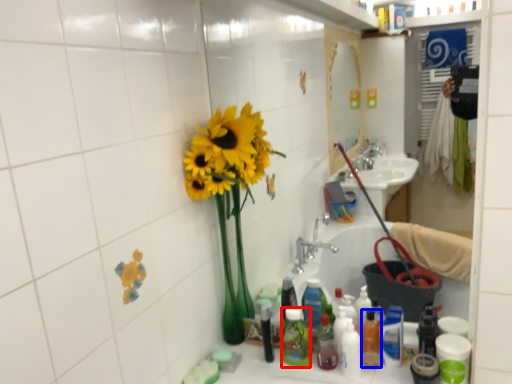
Question: Among these objects, which one is farthest to the camera, toiletry (highlighted by a red box) or bottle (highlighted by a blue box)?

Choices:
 (A) toiletry
 (B) bottle

Answer: (A)